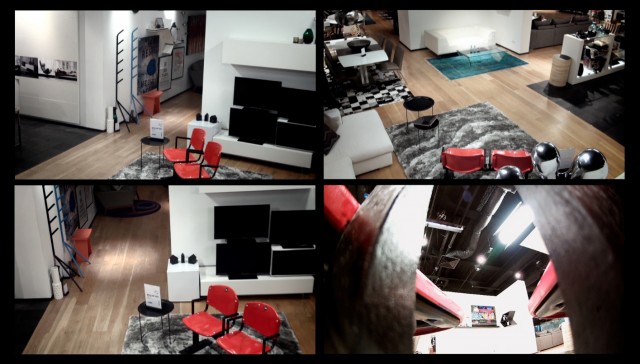
Where is `back rest of red chair`? Image resolution: width=640 pixels, height=364 pixels. back rest of red chair is located at coordinates (220, 303).